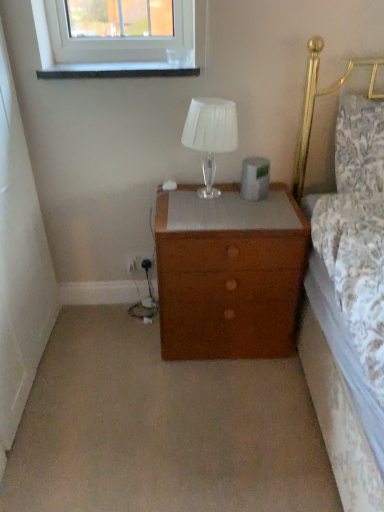
You are a GUI agent. You are given a task and a screenshot of the screen. Output one action in this format:
    pyautogui.click(x=<x>, y=<y>)
    Task: Click on the spots to the right of translucent glass table lamp at upper center
    This screenshot has width=384, height=512.
    Given the screenshot: What is the action you would take?
    pyautogui.click(x=244, y=196)